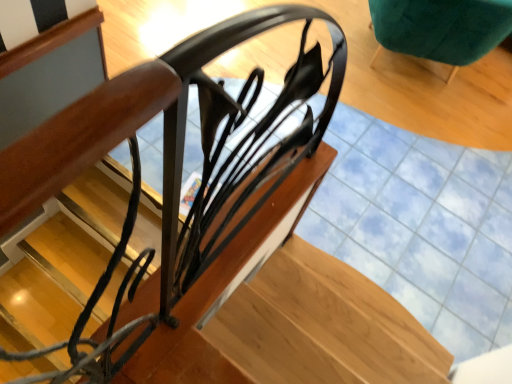
The image size is (512, 384). Describe the element at coordinates (441, 28) in the screenshot. I see `velvet green armchair at upper right` at that location.

Find the location of a particular element. velvet green armchair at upper right is located at coordinates (441, 28).

Where is `glossy metal stairs at center`? Image resolution: width=512 pixels, height=384 pixels. glossy metal stairs at center is located at coordinates (289, 317).

The height and width of the screenshot is (384, 512). Describe the element at coordinates (289, 317) in the screenshot. I see `glossy metal stairs at center` at that location.

Locate an element on the screen. Image resolution: width=512 pixels, height=384 pixels. velvet green armchair at upper right is located at coordinates (441, 28).

Is glossy metal stairs at center at the right side of velvet green armchair at upper right?

Incorrect, glossy metal stairs at center is not on the right side of velvet green armchair at upper right.

Relative to velvet green armchair at upper right, is glossy metal stairs at center in front or behind?

Clearly, glossy metal stairs at center is in front of velvet green armchair at upper right.

Which is behind, point (336, 322) or point (448, 13)?

The point (448, 13) is farther from the camera.

From the image's perspective, is glossy metal stairs at center over velvet green armchair at upper right?

Actually, glossy metal stairs at center appears below velvet green armchair at upper right in the image.

From a real-world perspective, does glossy metal stairs at center stand above velvet green armchair at upper right?

No, from a real-world perspective, glossy metal stairs at center is not over velvet green armchair at upper right

Can you confirm if glossy metal stairs at center is wider than velvet green armchair at upper right?

Yes, glossy metal stairs at center is wider than velvet green armchair at upper right.

Does glossy metal stairs at center have a greater height compared to velvet green armchair at upper right?

Incorrect, the height of glossy metal stairs at center is not larger of that of velvet green armchair at upper right.

Can you confirm if glossy metal stairs at center is bigger than velvet green armchair at upper right?

Yes, glossy metal stairs at center is bigger than velvet green armchair at upper right.

Which is correct: glossy metal stairs at center is inside velvet green armchair at upper right, or outside of it?

glossy metal stairs at center exists outside the volume of velvet green armchair at upper right.

Is the surface of glossy metal stairs at center in direct contact with velvet green armchair at upper right?

No, glossy metal stairs at center is not beside velvet green armchair at upper right.

Based on the photo, does glossy metal stairs at center turn towards velvet green armchair at upper right?

No, glossy metal stairs at center is not facing towards velvet green armchair at upper right.

Can you tell me how much glossy metal stairs at center and velvet green armchair at upper right differ in facing direction?

They differ by 148 degrees in their facing directions.

You are a GUI agent. You are given a task and a screenshot of the screen. Output one action in this format:
    pyautogui.click(x=<x>, y=<y>)
    Task: Click on the furniture on the right side of glossy metal stairs at center
    The image size is (512, 384).
    Given the screenshot: What is the action you would take?
    pos(441,28)

Looking at this image, is velvet green armchair at upper right to the left or to the right of glossy metal stairs at center in the image?

From the image, it's evident that velvet green armchair at upper right is to the right of glossy metal stairs at center.

Considering the relative positions of velvet green armchair at upper right and glossy metal stairs at center in the image provided, is velvet green armchair at upper right behind glossy metal stairs at center?

Yes, the depth of velvet green armchair at upper right is greater than that of glossy metal stairs at center.

Between point (441, 40) and point (348, 362), which one is positioned behind?

Positioned behind is point (441, 40).

From the image's perspective, is velvet green armchair at upper right over glossy metal stairs at center?

Yes, from the image's perspective, velvet green armchair at upper right is above glossy metal stairs at center.

From a real-world perspective, relative to glossy metal stairs at center, is velvet green armchair at upper right vertically above or below?

velvet green armchair at upper right is above glossy metal stairs at center.

Between velvet green armchair at upper right and glossy metal stairs at center, which one has larger width?

Wider between the two is glossy metal stairs at center.

Considering the relative sizes of velvet green armchair at upper right and glossy metal stairs at center in the image provided, is velvet green armchair at upper right taller than glossy metal stairs at center?

Indeed, velvet green armchair at upper right has a greater height compared to glossy metal stairs at center.

Which of these two, velvet green armchair at upper right or glossy metal stairs at center, is bigger?

With larger size is glossy metal stairs at center.

Is velvet green armchair at upper right outside of glossy metal stairs at center?

Absolutely, velvet green armchair at upper right is external to glossy metal stairs at center.

Is velvet green armchair at upper right directly adjacent to glossy metal stairs at center?

velvet green armchair at upper right and glossy metal stairs at center are not in contact.

Is velvet green armchair at upper right positioned with its back to glossy metal stairs at center?

No, velvet green armchair at upper right is not facing away from glossy metal stairs at center.

Consider the image. How far apart are velvet green armchair at upper right and glossy metal stairs at center?

velvet green armchair at upper right and glossy metal stairs at center are 1.92 meters apart.

This screenshot has width=512, height=384. What are the coordinates of `furniture to the right of glossy metal stairs at center` in the screenshot? It's located at (441, 28).

I want to click on stairs in front of the velvet green armchair at upper right, so click(289, 317).

Where is `stairs that is below the velvet green armchair at upper right (from the image's perspective)`? stairs that is below the velvet green armchair at upper right (from the image's perspective) is located at coordinates click(289, 317).